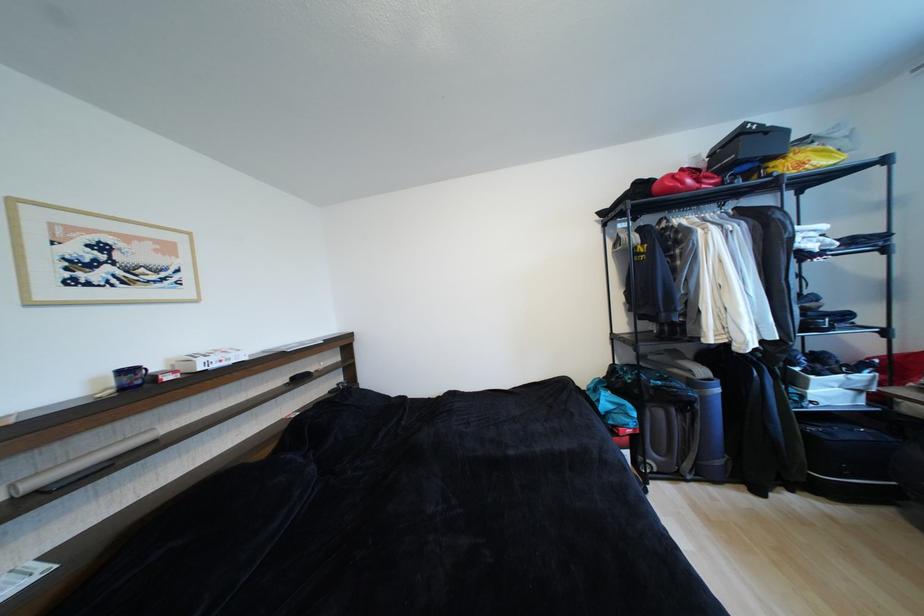
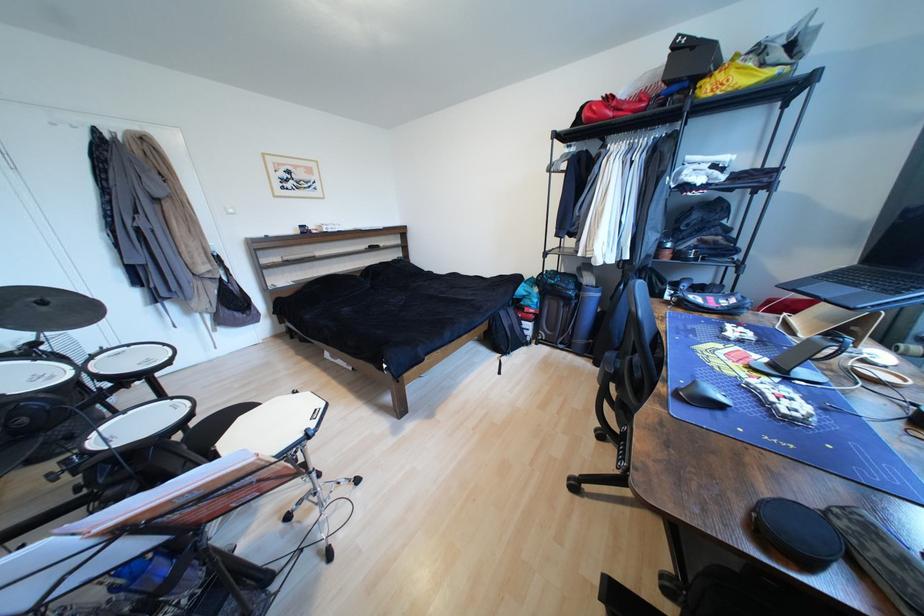
In the second image, find the point that corresponds to point 134,373 in the first image.

(310, 228)